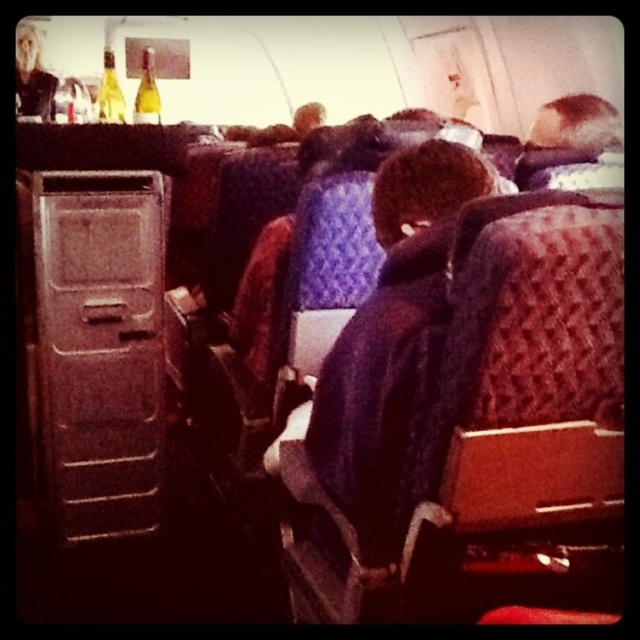
You are a flight attendant checking the storage areas in the airplane cabin. You need to retrieve the matte yellow glass bottle at upper left. Which object is located directly above the metallic gray drawer at left?

The matte yellow glass bottle at upper left is located directly above the metallic gray drawer at left.

You are a flight attendant checking the storage compartments. You notice the smooth brown hair at upper right and the matte yellow glass bottle at upper left. Which object is wider?

The smooth brown hair at upper right might be wider than matte yellow glass bottle at upper left.

You are a flight attendant checking the storage compartments. You notice the smooth brown hair at upper right and the matte yellow glass bottle at upper left. Which object takes up more space?

The smooth brown hair at upper right is bigger than the matte yellow glass bottle at upper left, so it takes up more space.